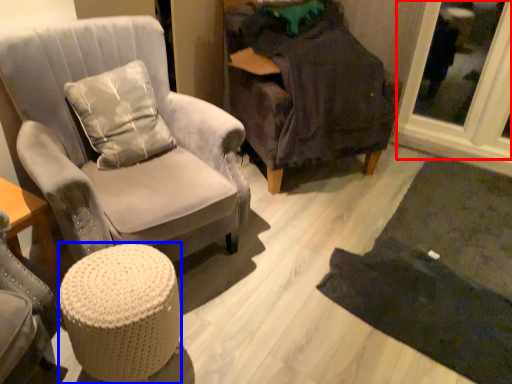
Question: Which point is further to the camera, glass door (highlighted by a red box) or stool (highlighted by a blue box)?

Choices:
 (A) glass door
 (B) stool

Answer: (A)